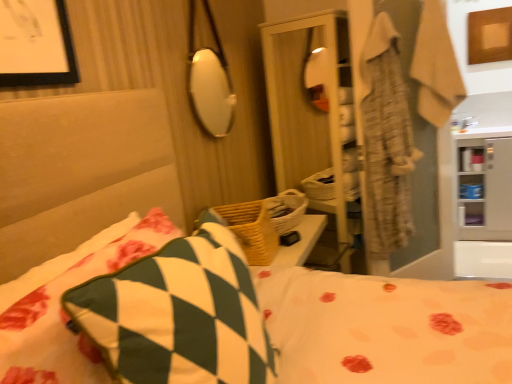
Measure the distance between white glossy cabinet at right and camera.

white glossy cabinet at right is 10.86 feet from camera.

What are the coordinates of `green and white checkered pillow at lower left, the 1th pillow viewed from the left` in the screenshot? It's located at (63, 311).

Describe the element at coordinates (63, 311) in the screenshot. This screenshot has width=512, height=384. I see `green and white checkered pillow at lower left, the 1th pillow viewed from the left` at that location.

At what (x,y) coordinates should I click in order to perform the action: click on woven wood basket at center, the second basket positioned from the front. Please return your answer as a coordinate pair (x, y). This screenshot has width=512, height=384. Looking at the image, I should click on (286, 210).

The height and width of the screenshot is (384, 512). I want to click on wooden picture frame at upper right, so click(x=490, y=35).

Is green and white checkered pillow at center, which is the second pillow from left to right, further to the viewer compared to wooden picture frame at upper right?

No, green and white checkered pillow at center, which is the second pillow from left to right, is closer to the viewer.

Can you confirm if green and white checkered pillow at center, which is the second pillow from left to right, is wider than wooden picture frame at upper right?

Yes.

Does green and white checkered pillow at center, the 1th pillow in the right-to-left sequence, have a lesser height compared to wooden picture frame at upper right?

In fact, green and white checkered pillow at center, the 1th pillow in the right-to-left sequence, may be taller than wooden picture frame at upper right.

Where is `picture frame behind the green and white checkered pillow at center, which is the second pillow from left to right`? This screenshot has height=384, width=512. picture frame behind the green and white checkered pillow at center, which is the second pillow from left to right is located at coordinates (490, 35).

Is green and white checkered pillow at center, which is the second pillow from left to right, shorter than beige textured robe at upper right?

Indeed, green and white checkered pillow at center, which is the second pillow from left to right, has a lesser height compared to beige textured robe at upper right.

From the picture: Is green and white checkered pillow at center, which is the second pillow from left to right, facing away from beige textured robe at upper right?

No, beige textured robe at upper right is not at the back of green and white checkered pillow at center, which is the second pillow from left to right.

Looking at their sizes, would you say green and white checkered pillow at center, the 1th pillow in the right-to-left sequence, is wider or thinner than beige textured robe at upper right?

Clearly, green and white checkered pillow at center, the 1th pillow in the right-to-left sequence, has less width compared to beige textured robe at upper right.

Is green and white checkered pillow at center, which is the second pillow from left to right, at the right side of beige textured robe at upper right?

No.

Where is `cabinet beneath the green and white checkered pillow at center, the 1th pillow in the right-to-left sequence (from a real-world perspective)`? The height and width of the screenshot is (384, 512). cabinet beneath the green and white checkered pillow at center, the 1th pillow in the right-to-left sequence (from a real-world perspective) is located at coordinates (485, 189).

Considering the positions of objects green and white checkered pillow at center, the 1th pillow in the right-to-left sequence, and white glossy cabinet at right in the image provided, who is behind, green and white checkered pillow at center, the 1th pillow in the right-to-left sequence, or white glossy cabinet at right?

white glossy cabinet at right is behind.

Is green and white checkered pillow at center, the 1th pillow in the right-to-left sequence, shorter than white glossy cabinet at right?

Yes.

Is wooden picture frame at upper right wider or thinner than woven wood basket at center, placed as the 1th basket when sorted from back to front?

Clearly, wooden picture frame at upper right has less width compared to woven wood basket at center, placed as the 1th basket when sorted from back to front.

From the image's perspective, is wooden picture frame at upper right located beneath woven wood basket at center, placed as the 1th basket when sorted from back to front?

No, from the image's perspective, wooden picture frame at upper right is not below woven wood basket at center, placed as the 1th basket when sorted from back to front.

Can we say wooden picture frame at upper right lies outside woven wood basket at center, the second basket positioned from the front?

Indeed, wooden picture frame at upper right is completely outside woven wood basket at center, the second basket positioned from the front.

Can you confirm if wooden picture frame at upper right is bigger than woven wood basket at center, the second basket positioned from the front?

No, wooden picture frame at upper right is not bigger than woven wood basket at center, the second basket positioned from the front.

Who is taller, woven wood basket at center, which ranks as the 2th basket in back-to-front order, or green and white checkered pillow at lower left, which is counted as the 2th pillow, starting from the right?

woven wood basket at center, which ranks as the 2th basket in back-to-front order.

From a real-world perspective, starting from the woven wood basket at center, which is the 1th basket from front to back, which pillow is the 2nd one vertically above it? Please provide its 2D coordinates.

[(63, 311)]

Is woven wood basket at center, which ranks as the 2th basket in back-to-front order, positioned with its back to green and white checkered pillow at lower left, the 1th pillow viewed from the left?

No, woven wood basket at center, which ranks as the 2th basket in back-to-front order,'s orientation is not away from green and white checkered pillow at lower left, the 1th pillow viewed from the left.

How different are the orientations of woven wood basket at center, which is the 1th basket from front to back, and green and white checkered pillow at lower left, which is counted as the 2th pillow, starting from the right, in degrees?

They differ by 10.9 degrees in their facing directions.

From a real-world perspective, is wooden picture frame at upper right on top of beige textured robe at upper right?

Yes.

Is wooden picture frame at upper right positioned with its back to beige textured robe at upper right?

That's not correct — wooden picture frame at upper right is not looking away from beige textured robe at upper right.

Is wooden picture frame at upper right not near beige textured robe at upper right?

Yes, wooden picture frame at upper right and beige textured robe at upper right are located far from each other.

Find the location of a particular element. Image resolution: width=512 pixels, height=384 pixels. picture frame on the right of the beige textured robe at upper right is located at coordinates (490, 35).

Does point (242, 223) come behind point (474, 47)?

No, it is in front of (474, 47).

Can you confirm if woven wood basket at center, placed as the 1th basket when sorted from back to front, is positioned to the left of wooden picture frame at upper right?

Correct, you'll find woven wood basket at center, placed as the 1th basket when sorted from back to front, to the left of wooden picture frame at upper right.

What's the angular difference between woven wood basket at center, the second basket positioned from the front, and wooden picture frame at upper right's facing directions?

The angle between the facing direction of woven wood basket at center, the second basket positioned from the front, and the facing direction of wooden picture frame at upper right is 89.2 degrees.

Where is `picture frame that appears above the green and white checkered pillow at center, the 1th pillow in the right-to-left sequence (from a real-world perspective)`? Image resolution: width=512 pixels, height=384 pixels. picture frame that appears above the green and white checkered pillow at center, the 1th pillow in the right-to-left sequence (from a real-world perspective) is located at coordinates (490, 35).

Where is `robe located on the right of green and white checkered pillow at center, the 1th pillow in the right-to-left sequence`? The height and width of the screenshot is (384, 512). robe located on the right of green and white checkered pillow at center, the 1th pillow in the right-to-left sequence is located at coordinates (436, 66).

Estimate the real-world distances between objects in this image. Which object is closer to wooden picture frame at upper right, white glossy cabinet at right or beige textured robe at upper right?

white glossy cabinet at right is positioned closer to the anchor wooden picture frame at upper right.

Looking at the image, which one is located further to woven wood basket at center, placed as the 1th basket when sorted from back to front, beige textured robe at upper right or green and white checkered pillow at center, the 1th pillow in the right-to-left sequence?

The object further to woven wood basket at center, placed as the 1th basket when sorted from back to front, is beige textured robe at upper right.

Based on their spatial positions, is woven wood basket at center, the second basket positioned from the front, or beige textured robe at upper right closer to green and white checkered pillow at lower left, which is counted as the 2th pillow, starting from the right?

woven wood basket at center, the second basket positioned from the front, lies closer to green and white checkered pillow at lower left, which is counted as the 2th pillow, starting from the right, than the other object.

Which object lies nearer to the anchor point wooden picture frame at upper right, woven wood basket at center, which is the 1th basket from front to back, or white glossy cabinet at right?

The object closer to wooden picture frame at upper right is white glossy cabinet at right.

From the image, which object appears to be farther from wooden picture frame at upper right, white glossy cabinet at right or green and white checkered pillow at center, which is the second pillow from left to right?

green and white checkered pillow at center, which is the second pillow from left to right, is positioned further to the anchor wooden picture frame at upper right.

Based on their spatial positions, is green and white checkered pillow at lower left, the 1th pillow viewed from the left, or white glossy cabinet at right closer to green and white checkered pillow at center, which is the second pillow from left to right?

green and white checkered pillow at lower left, the 1th pillow viewed from the left, lies closer to green and white checkered pillow at center, which is the second pillow from left to right, than the other object.

When comparing their distances from green and white checkered pillow at center, which is the second pillow from left to right, does wooden picture frame at upper right or white glossy cabinet at right seem closer?

Among the two, white glossy cabinet at right is located nearer to green and white checkered pillow at center, which is the second pillow from left to right.

Which object lies further to the anchor point white glossy cabinet at right, green and white checkered pillow at center, the 1th pillow in the right-to-left sequence, or green and white checkered pillow at lower left, the 1th pillow viewed from the left?

green and white checkered pillow at lower left, the 1th pillow viewed from the left, lies further to white glossy cabinet at right than the other object.

The height and width of the screenshot is (384, 512). Identify the location of robe between woven wood basket at center, placed as the 1th basket when sorted from back to front, and white glossy cabinet at right from left to right. (436, 66).

Find the location of a particular element. This screenshot has width=512, height=384. pillow positioned between green and white checkered pillow at center, which is the second pillow from left to right, and woven wood basket at center, which is the 1th basket from front to back, from near to far is located at coordinates (63, 311).

Where is `picture frame between woven wood basket at center, which ranks as the 2th basket in back-to-front order, and white glossy cabinet at right`? The width and height of the screenshot is (512, 384). picture frame between woven wood basket at center, which ranks as the 2th basket in back-to-front order, and white glossy cabinet at right is located at coordinates (490, 35).

This screenshot has height=384, width=512. Find the location of `basket positioned between green and white checkered pillow at lower left, which is counted as the 2th pillow, starting from the right, and woven wood basket at center, the second basket positioned from the front, from near to far`. basket positioned between green and white checkered pillow at lower left, which is counted as the 2th pillow, starting from the right, and woven wood basket at center, the second basket positioned from the front, from near to far is located at coordinates (247, 229).